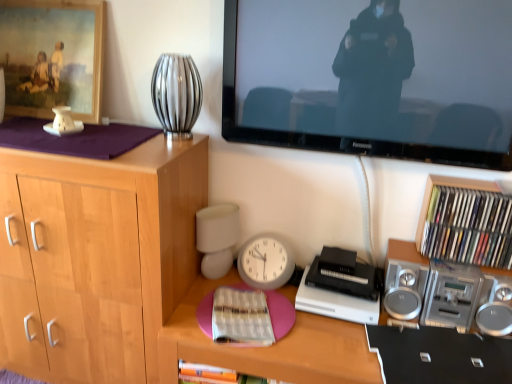
Image resolution: width=512 pixels, height=384 pixels. In order to click on blank space situated above black plastic printer at center (from a real-world perspective) in this screenshot , I will do coord(346,270).